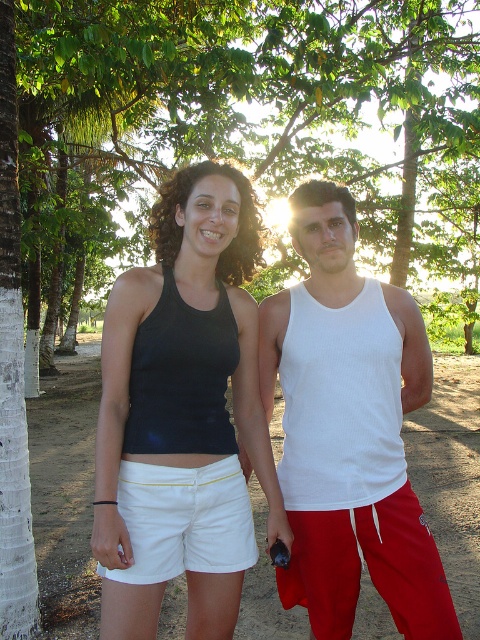
Question: Is white ribbed tank top at center in front of black matte tank top at center?

Choices:
 (A) yes
 (B) no

Answer: (B)

Question: Is white bark tree at center above white cotton shorts at center?

Choices:
 (A) yes
 (B) no

Answer: (A)

Question: Can you confirm if white bark tree at center is thinner than white cotton shorts at center?

Choices:
 (A) no
 (B) yes

Answer: (A)

Question: Estimate the real-world distances between objects in this image. Which object is farther from the black matte tank top at center?

Choices:
 (A) white bark tree at center
 (B) white ribbed tank top at center

Answer: (A)

Question: Which object appears farthest from the camera in this image?

Choices:
 (A) black matte tank top at center
 (B) white cotton shorts at center

Answer: (B)

Question: Among these objects, which one is nearest to the camera?

Choices:
 (A) white ribbed tank top at center
 (B) white cotton shorts at center
 (C) black matte tank top at center

Answer: (C)